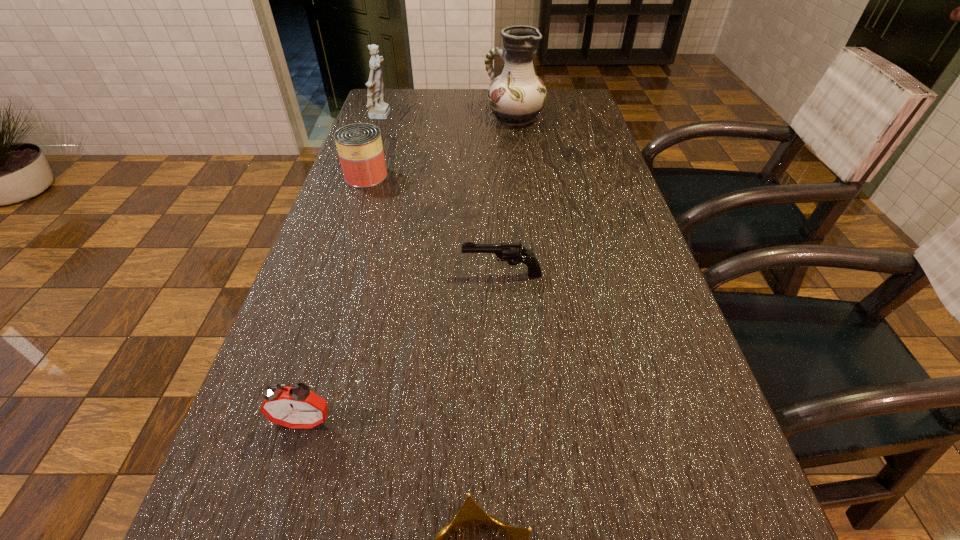
Locate an element on the screen. vase is located at coordinates (516, 96).

At what (x,y) coordinates should I click in order to perform the action: click on the second tallest object. Please return your answer as a coordinate pair (x, y). The height and width of the screenshot is (540, 960). Looking at the image, I should click on (377, 109).

The width and height of the screenshot is (960, 540). I want to click on can, so click(359, 145).

Locate an element on the screen. The image size is (960, 540). the second nearest object is located at coordinates (296, 406).

You are a GUI agent. You are given a task and a screenshot of the screen. Output one action in this format:
    pyautogui.click(x=<x>, y=<y>)
    Task: Click on the gun
    The width and height of the screenshot is (960, 540).
    Given the screenshot: What is the action you would take?
    pyautogui.click(x=512, y=253)

The width and height of the screenshot is (960, 540). Find the location of `vacant space located 0.200m on the left of the vase`. vacant space located 0.200m on the left of the vase is located at coordinates (424, 118).

This screenshot has height=540, width=960. I want to click on free space located on the front-facing side of the figurine, so click(x=423, y=117).

Identify the location of vacant region located 0.230m on the front of the fourth nearest object. (343, 244).

In order to click on free space located 0.050m on the clock face of the alarm clock in this screenshot , I will do `click(292, 465)`.

Identify the location of free location located at the end of the barrel of the gun. The height and width of the screenshot is (540, 960). (374, 274).